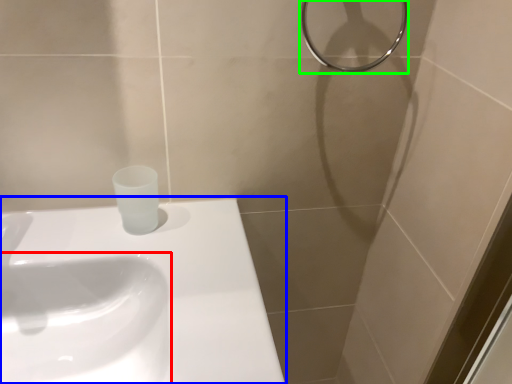
Question: Estimate the real-world distances between objects in this image. Which object is closer to sink (highlighted by a red box), sink (highlighted by a blue box) or shower (highlighted by a green box)?

Choices:
 (A) sink
 (B) shower

Answer: (A)